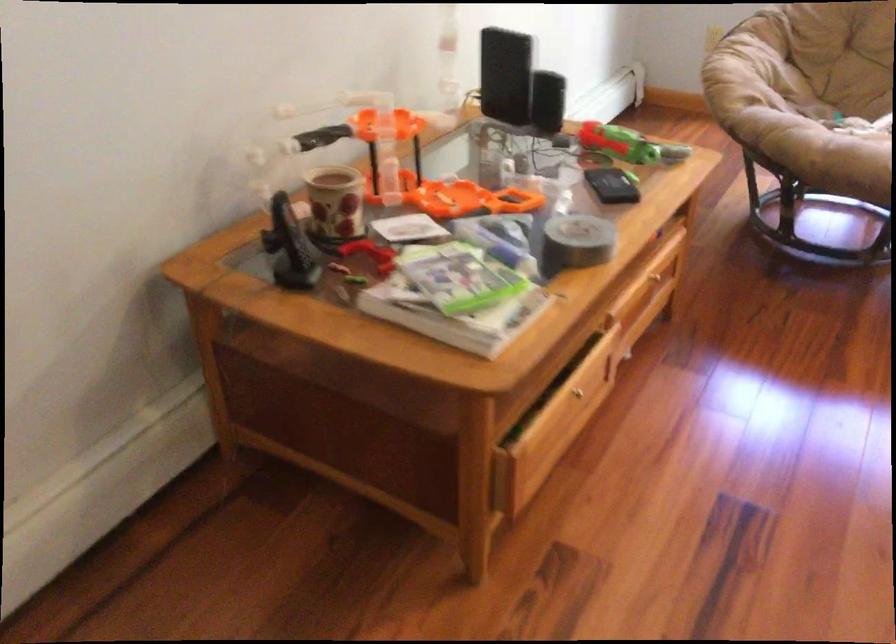
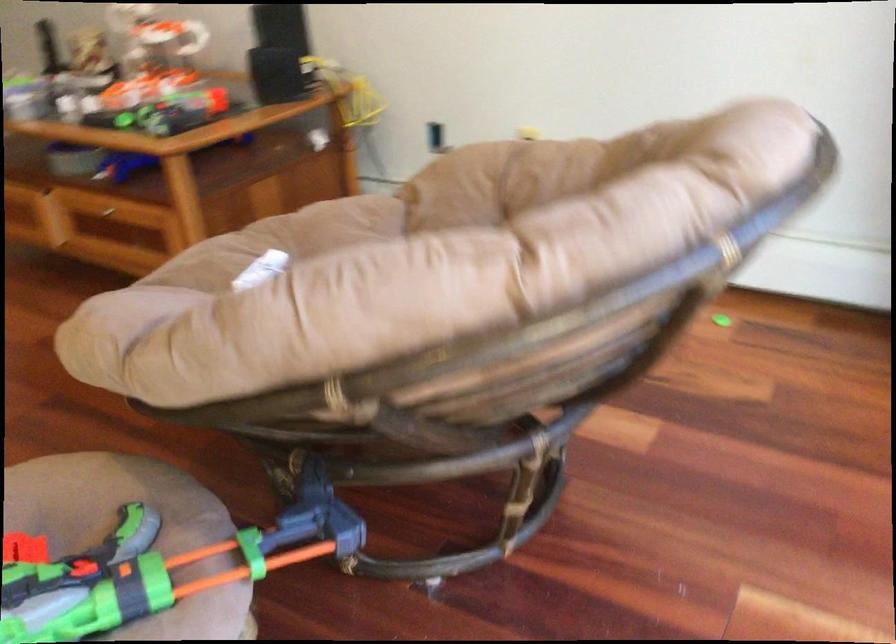
Question: I am providing you with two images of the same scene from different viewpoints. Please identify which objects are invisible in image2.

Choices:
 (A) brown jar lid
 (B) toy gun handle
 (C) chair sitting surface
 (D) drawer handle

Answer: (C)